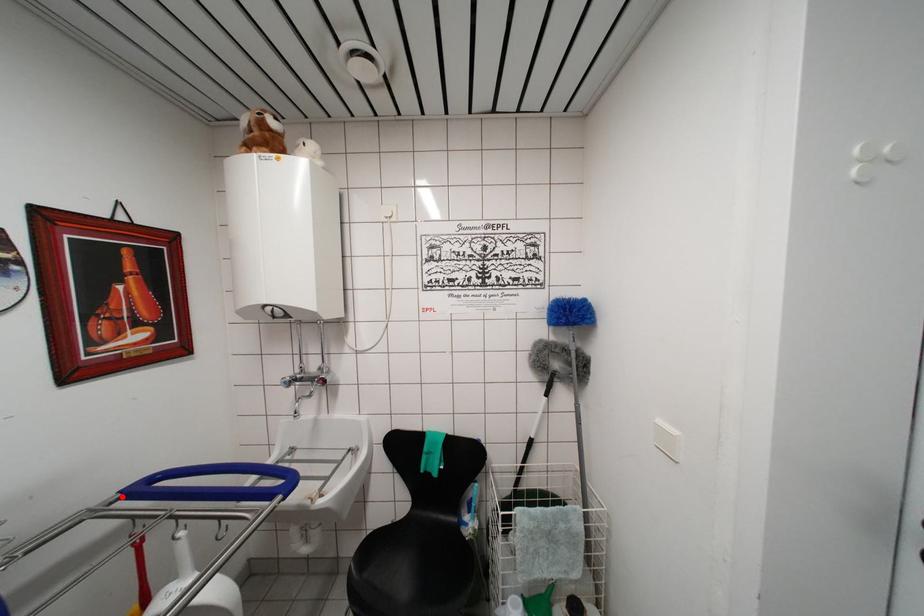
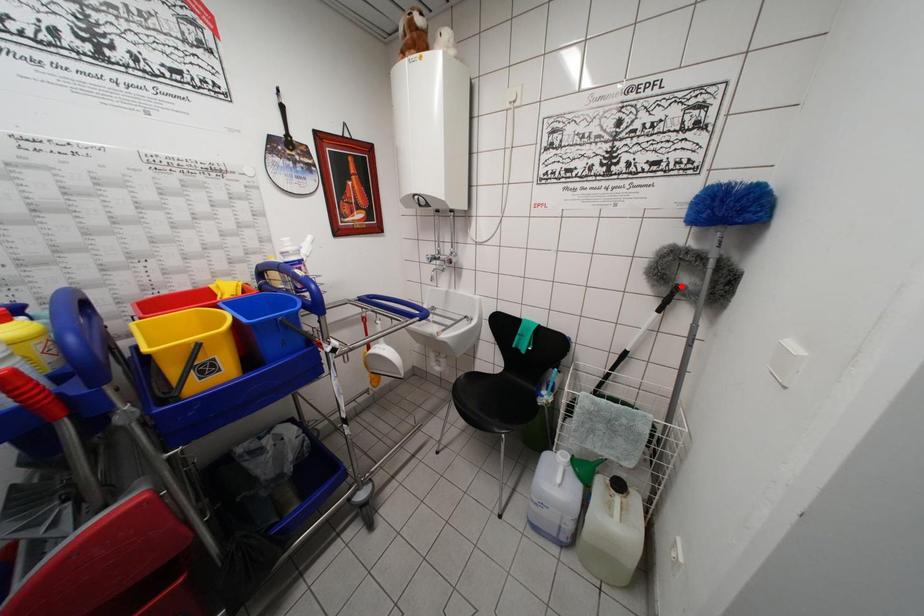
I am providing you with two images of the same scene from different viewpoints. A red point is marked on the first image and another point is marked on the second image. Is the red point in image1 aligned with the point shown in image2?

No